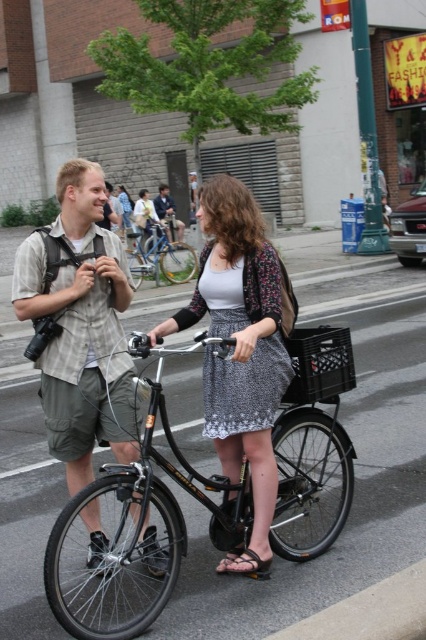
Between matte khaki shirt at center and silver metallic bicycle at center, which one appears on the right side from the viewer's perspective?

From the viewer's perspective, matte khaki shirt at center appears more on the right side.

Find the location of a particular element. The height and width of the screenshot is (640, 426). matte khaki shirt at center is located at coordinates (80, 326).

Does matte khaki shirt at center appear under printed cotton dress at center?

Yes, matte khaki shirt at center is below printed cotton dress at center.

Can you confirm if matte khaki shirt at center is smaller than printed cotton dress at center?

No, matte khaki shirt at center is not smaller than printed cotton dress at center.

Where is `matte khaki shirt at center`? matte khaki shirt at center is located at coordinates (80, 326).

Which is below, matte khaki shirt at center or patterned fabric skirt at center?

Positioned lower is patterned fabric skirt at center.

Can you confirm if matte khaki shirt at center is taller than patterned fabric skirt at center?

Yes.

Is point (81, 385) in front of point (267, 324)?

No, it is not.

The image size is (426, 640). Find the location of `matte khaki shirt at center`. matte khaki shirt at center is located at coordinates (80, 326).